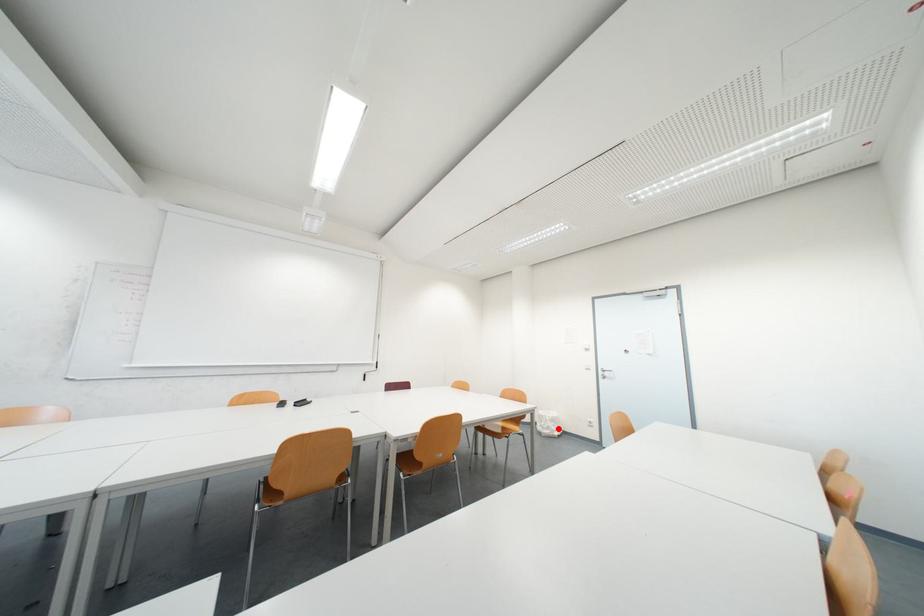
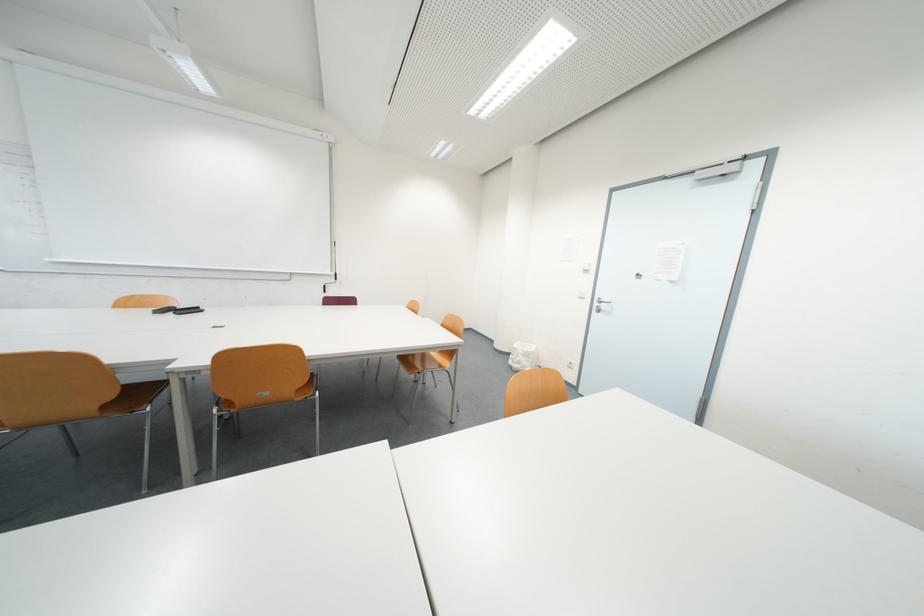
The point at the highlighted location is marked in the first image. Where is the corresponding point in the second image?

(529, 363)